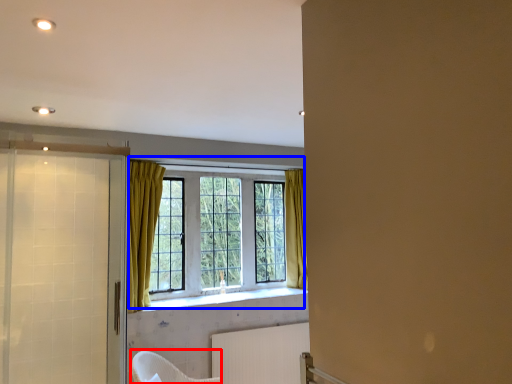
Question: Which object appears closest to the camera in this image, armchair (highlighted by a red box) or window (highlighted by a blue box)?

Choices:
 (A) armchair
 (B) window

Answer: (A)